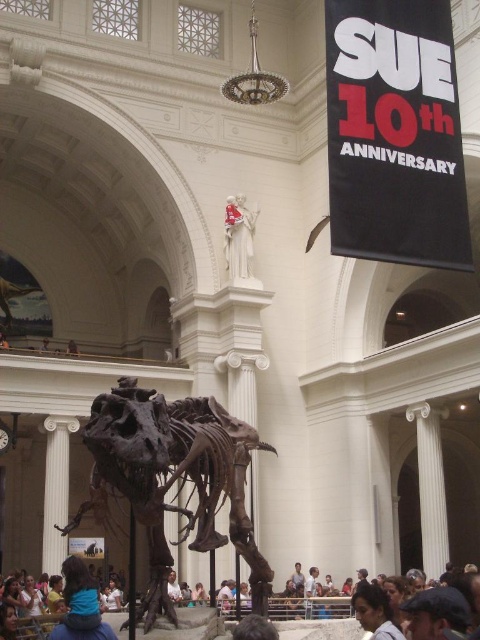
You are an interior designer planning to place a large sculpture in the museum hall. You notice the shiny metallic dinosaur skeleton at center and the blue fabric at lower left. Which object is wider, and can you place the sculpture between them without it overlapping?

The shiny metallic dinosaur skeleton at center is wider than the blue fabric at lower left. Since the sculpture needs to be placed between them, its width must be less than the narrower object, which is the blue fabric at lower left. Therefore, the sculpture should be narrower than the blue fabric at lower left to fit between them without overlapping.

You are a visitor standing at the entrance of the museum hall. You see the shiny metallic dinosaur skeleton at center and the blue fabric at lower left. Which object is closer to you?

The shiny metallic dinosaur skeleton at center is closer to you since it is in front of the blue fabric at lower left.